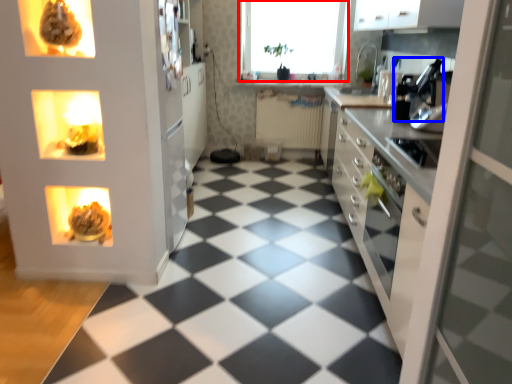
Question: Which point is closer to the camera, window (highlighted by a red box) or appliance (highlighted by a blue box)?

Choices:
 (A) window
 (B) appliance

Answer: (B)